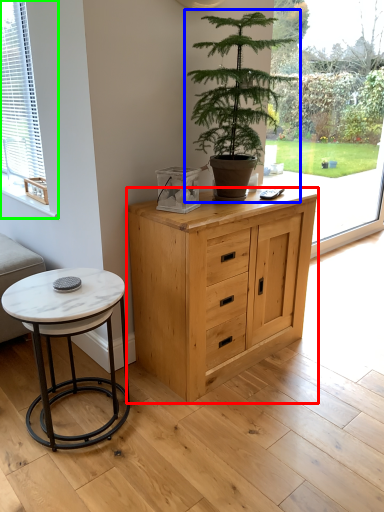
Question: Based on their relative distances, which object is nearer to chest of drawers (highlighted by a red box)? Choose from houseplant (highlighted by a blue box) and window (highlighted by a green box).

Choices:
 (A) houseplant
 (B) window

Answer: (A)